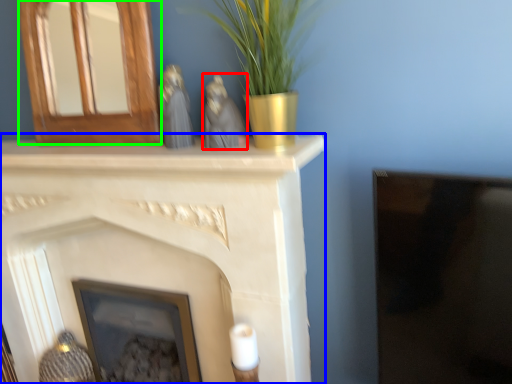
Question: Which object is positioned farthest from animal (highlighted by a red box)? Select from fireplace (highlighted by a blue box) and fireplace (highlighted by a green box).

Choices:
 (A) fireplace
 (B) fireplace

Answer: (A)